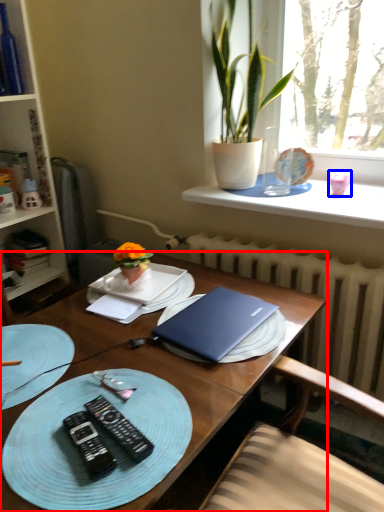
Question: Which of the following is the closest to the observer, desk (highlighted by a red box) or coffee cup (highlighted by a blue box)?

Choices:
 (A) desk
 (B) coffee cup

Answer: (A)